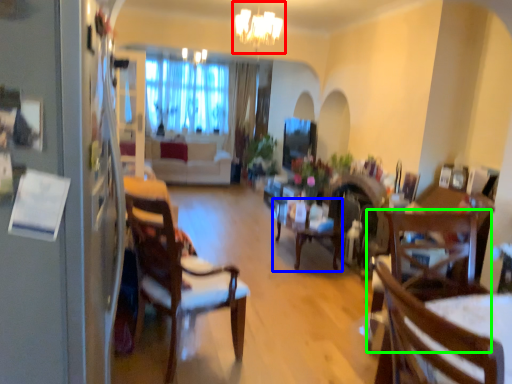
Question: Which object is the closest to the light fixture (highlighted by a red box)? Choose among these: table (highlighted by a blue box) or chair (highlighted by a green box).

Choices:
 (A) table
 (B) chair

Answer: (A)